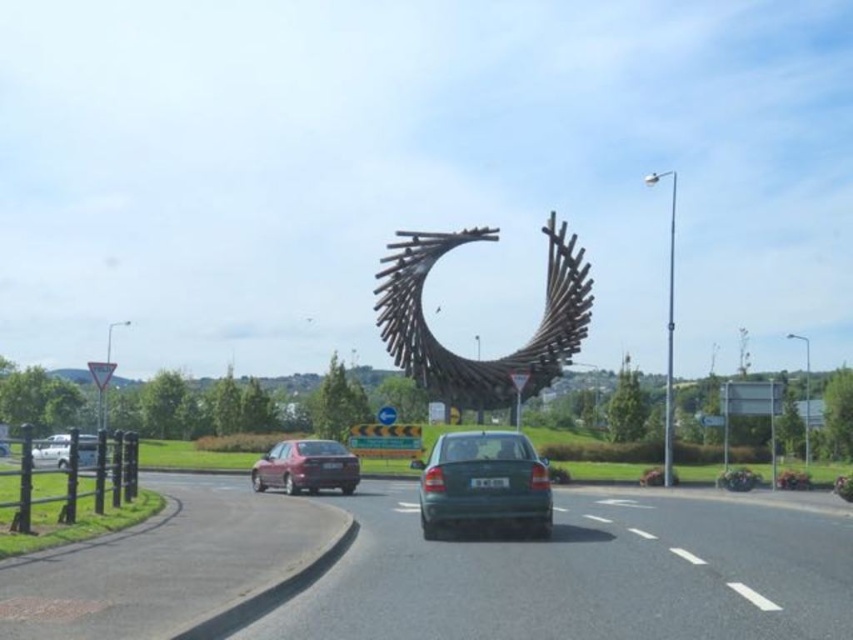
You are a city planner evaluating the roundabout design. Considering the smooth asphalt road at center and the wooden sculpture at center, which one occupies a larger area in the image?

The wooden sculpture at center occupies a larger area than the smooth asphalt road at center according to the description.

You are a pedestrian standing at the center of the roundabout. You see the matte red sedan at left and the white matte van at lower left. Which vehicle is positioned higher relative to your viewpoint?

The matte red sedan at left is positioned higher than the white matte van at lower left based on their placement in the scene.

You are a delivery driver who needs to park your truck, which is 2.5 meters wide, in this roundabout scene. The parking spot is between the matte red sedan at left and the white matte van at lower left. Can your truck fit in the space between them?

The matte red sedan at left is narrower than the white matte van at lower left. However, the exact width of the space between them isn not provided. To determine if the truck can fit, you need to calculate the total available width by adding the gap between the two vehicles and subtracting their combined widths from the roundabout lane width. Without specific measurements, it is uncertain whether the 2.5 meter wide truck will fit.